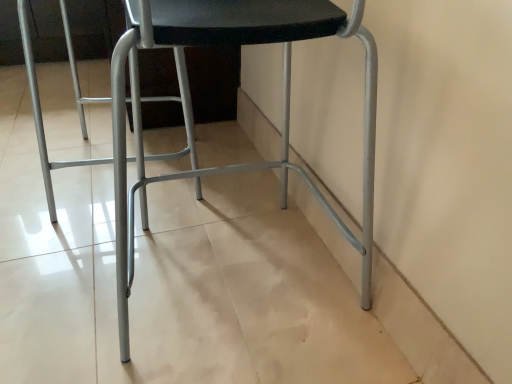
The image size is (512, 384). I want to click on vacant space in between metallic gray chair at center and metallic silver swivel chair at center, so click(168, 215).